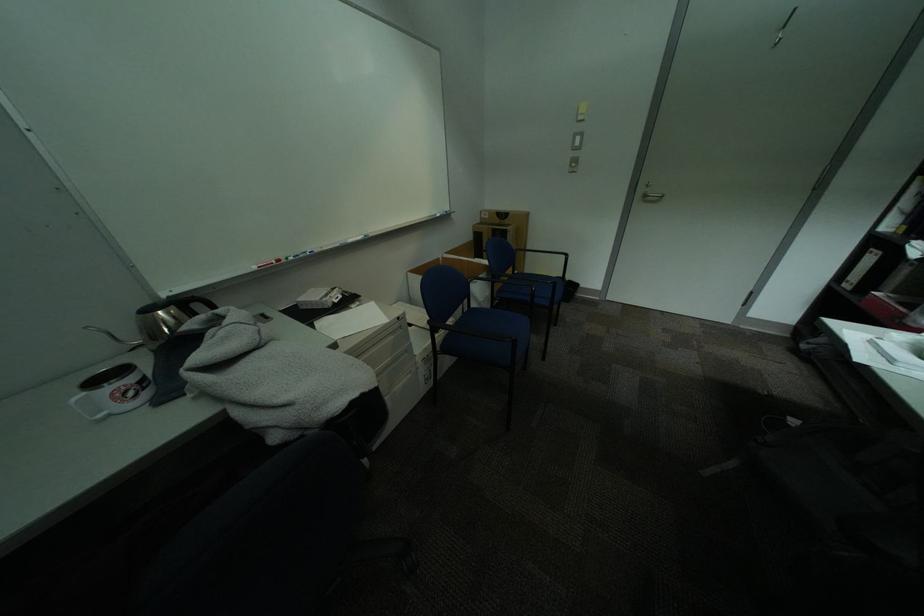
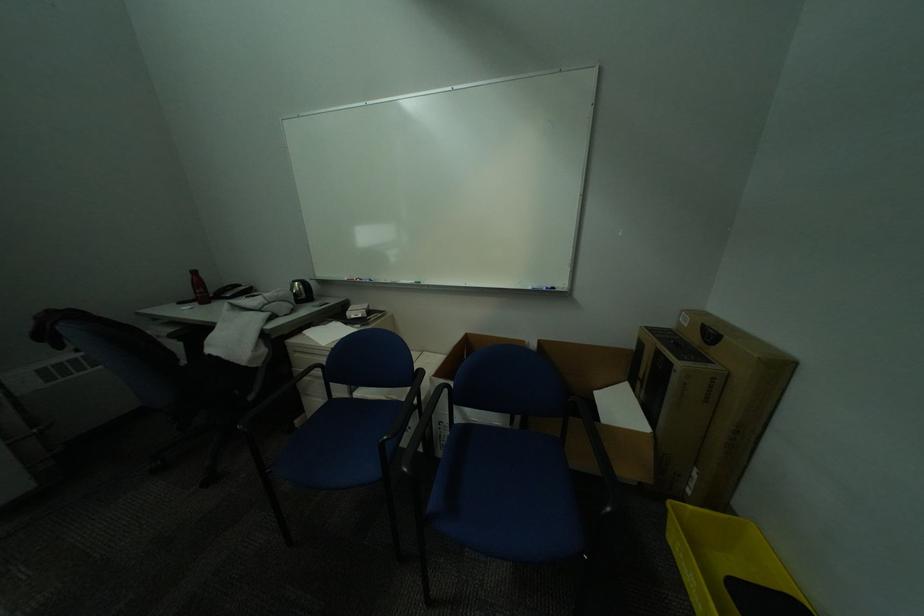
Question: I am providing you with two images of the same scene from different viewpoints. After the viewpoint changes to image2, which objects are now occluded?

Choices:
 (A) yellow plastic bin
 (B) whiteboard marker
 (C) blue chair sitting surface
 (D) none of these

Answer: (D)